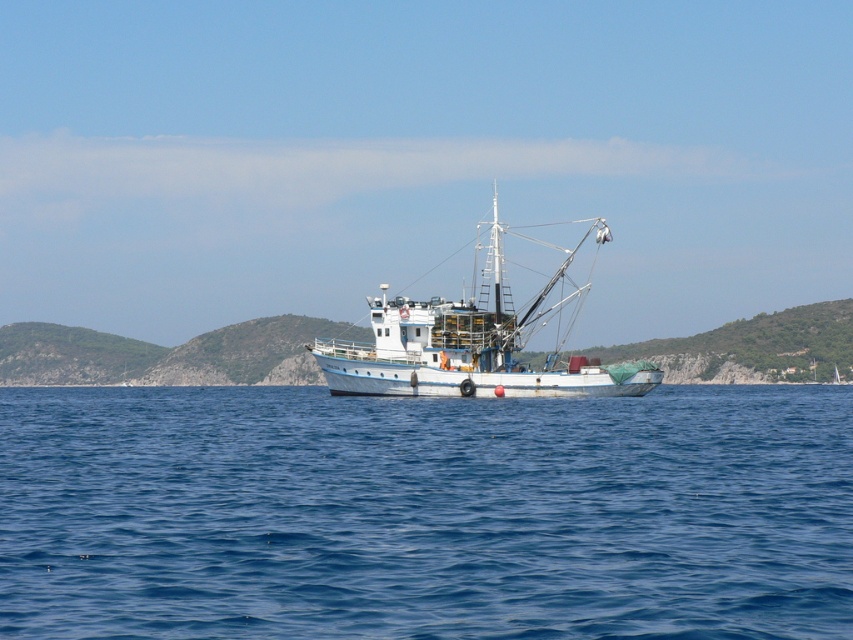
Question: Is blue water at center above white matte boat at center?

Choices:
 (A) no
 (B) yes

Answer: (A)

Question: Is blue water at center bigger than white matte boat at center?

Choices:
 (A) no
 (B) yes

Answer: (A)

Question: Is blue water at center to the left of white matte boat at center from the viewer's perspective?

Choices:
 (A) yes
 (B) no

Answer: (A)

Question: Which point is farther from the camera taking this photo?

Choices:
 (A) (160, 488)
 (B) (410, 300)

Answer: (B)

Question: Among these objects, which one is farthest from the camera?

Choices:
 (A) blue water at center
 (B) white matte boat at center

Answer: (B)

Question: Which object appears closest to the camera in this image?

Choices:
 (A) blue water at center
 (B) white matte boat at center

Answer: (A)